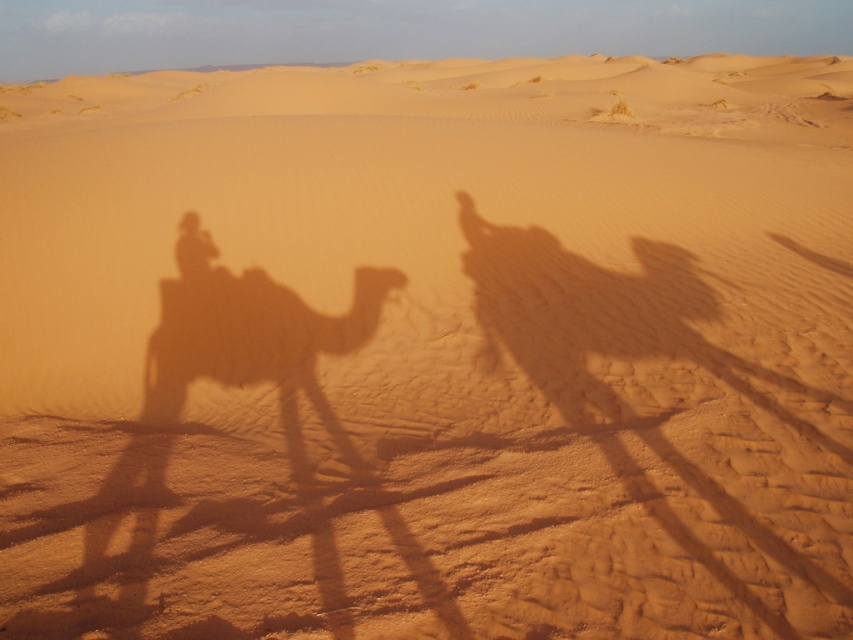
You are a photographer planning to take a photo of the two camels. The brown textured camel at left and the smooth sand camel at center. You want to ensure both camels are fully visible in the frame. Given that your camera can only capture objects up to the width of the wider camel, which camel determines the minimum required frame width?

The brown textured camel at left determines the minimum required frame width because its width surpasses that of the smooth sand camel at center.

You are a photographer planning to capture the shadows of the brown textured camel at left and the smooth sand camel at center. Based on the scene, which camel will have its shadow positioned lower on the ground?

The brown textured camel at left is below the smooth sand camel at center, so its shadow will be positioned lower on the ground.

You are a photographer trying to capture the exact position of the brown textured camel at left in the desert scene. According to the coordinates provided, where is the camel located in terms of its 2D position?

The brown textured camel at left is located at the 2D coordinates point [256,344].